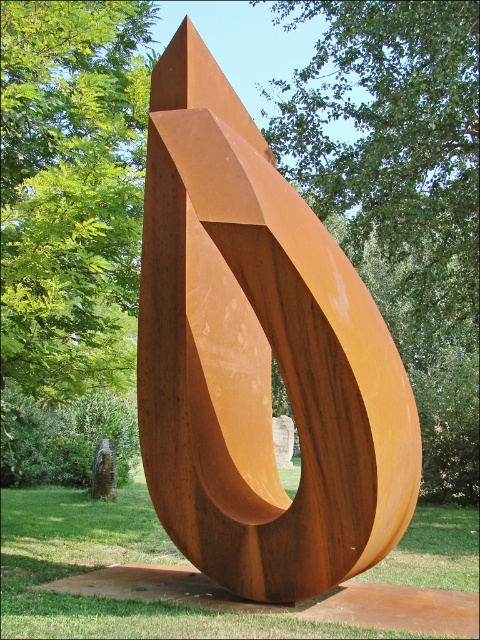
Question: Is rusty metal abstract at center to the right of rusty metal sculpture at center from the viewer's perspective?

Choices:
 (A) no
 (B) yes

Answer: (A)

Question: Is rusty metal abstract at center positioned in front of green leafy tree at upper left?

Choices:
 (A) yes
 (B) no

Answer: (A)

Question: Does rusty metal abstract at center have a larger size compared to rusty metal sculpture at center?

Choices:
 (A) yes
 (B) no

Answer: (B)

Question: Considering the real-world distances, which object is farthest from the green leafy tree at upper left?

Choices:
 (A) rusty metal abstract at center
 (B) rusty metal sculpture at center

Answer: (B)

Question: Which point is farther to the camera?

Choices:
 (A) green leafy tree at upper left
 (B) rusty metal sculpture at center
 (C) rusty metal abstract at center

Answer: (A)

Question: Estimate the real-world distances between objects in this image. Which object is farther from the rusty metal abstract at center?

Choices:
 (A) green leafy tree at upper left
 (B) rusty metal sculpture at center

Answer: (B)